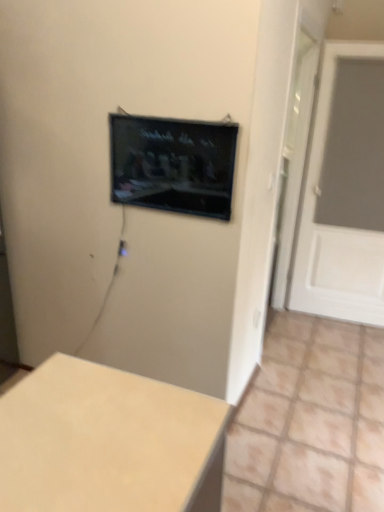
Question: Does white matte door at right have a lesser width compared to black glossy tv at upper center?

Choices:
 (A) no
 (B) yes

Answer: (A)

Question: From the image's perspective, is white matte door at right above black glossy tv at upper center?

Choices:
 (A) no
 (B) yes

Answer: (B)

Question: Does white matte door at right come in front of black glossy tv at upper center?

Choices:
 (A) no
 (B) yes

Answer: (A)

Question: Is white matte door at right facing towards black glossy tv at upper center?

Choices:
 (A) yes
 (B) no

Answer: (B)

Question: Considering the relative sizes of white matte door at right and black glossy tv at upper center in the image provided, is white matte door at right bigger than black glossy tv at upper center?

Choices:
 (A) no
 (B) yes

Answer: (B)

Question: Can you confirm if white matte door at right is smaller than black glossy tv at upper center?

Choices:
 (A) no
 (B) yes

Answer: (A)

Question: Considering the relative positions of beige matte table at lower left and white matte door at right in the image provided, is beige matte table at lower left behind white matte door at right?

Choices:
 (A) no
 (B) yes

Answer: (A)

Question: Does beige matte table at lower left have a lesser height compared to white matte door at right?

Choices:
 (A) yes
 (B) no

Answer: (A)

Question: Could you tell me if beige matte table at lower left is facing white matte door at right?

Choices:
 (A) yes
 (B) no

Answer: (A)

Question: Can white matte door at right be found inside beige matte table at lower left?

Choices:
 (A) yes
 (B) no

Answer: (B)

Question: Is beige matte table at lower left at the right side of white matte door at right?

Choices:
 (A) no
 (B) yes

Answer: (A)

Question: Is beige matte table at lower left not within white matte door at right?

Choices:
 (A) yes
 (B) no

Answer: (A)

Question: From the image's perspective, does white matte door at right appear lower than beige matte table at lower left?

Choices:
 (A) yes
 (B) no

Answer: (B)